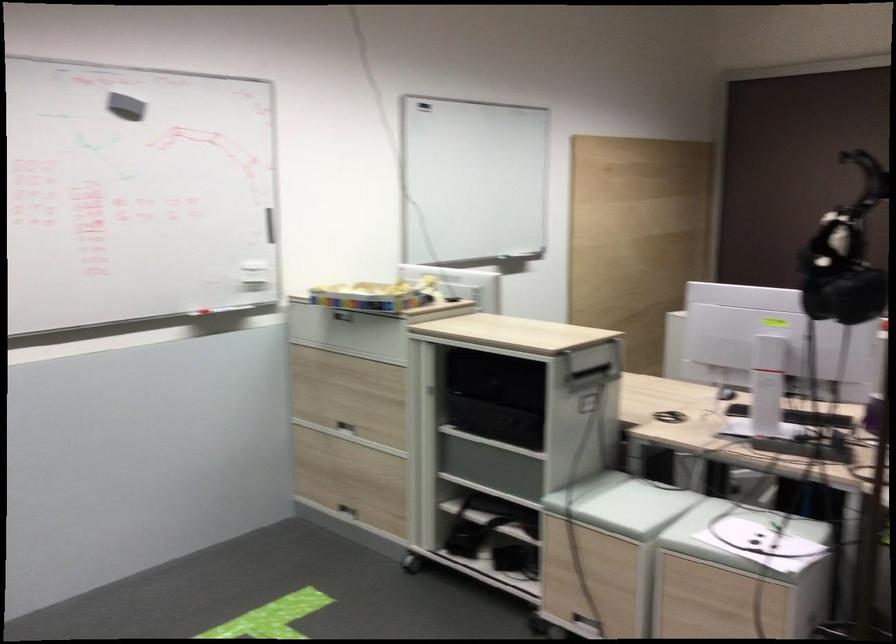
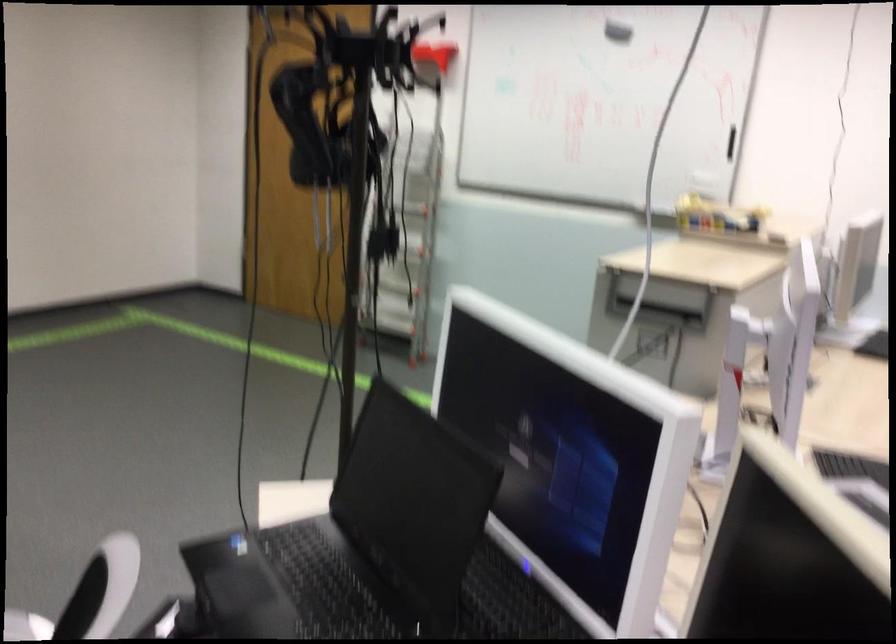
In the second image, find the point that corresponds to [138,131] in the first image.

(617, 32)